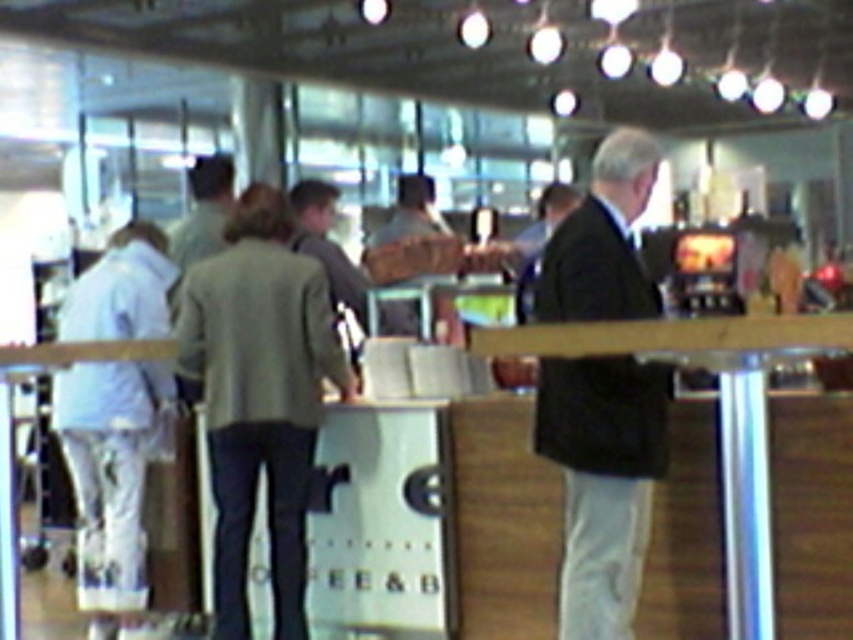
You are a customer at the cafe and want to find someone wearing both the green wool jacket at center and the white fabric pants at left. Can you tell me if the jacket is longer or shorter than the pants?

The green wool jacket at center is shorter than the white fabric pants at left.